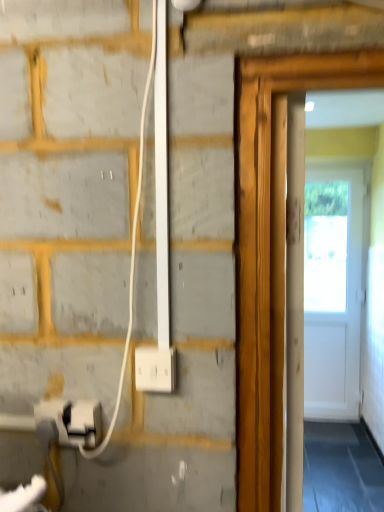
Question: Is point (66, 423) closer or farther from the camera than point (155, 356)?

Choices:
 (A) closer
 (B) farther

Answer: (B)

Question: Would you say white plastic electric outlet at lower left is to the left or to the right of white plastic socket at lower center in the picture?

Choices:
 (A) left
 (B) right

Answer: (A)

Question: Considering the positions of white plastic electric outlet at lower left and white plastic socket at lower center in the image, is white plastic electric outlet at lower left wider or thinner than white plastic socket at lower center?

Choices:
 (A) thin
 (B) wide

Answer: (A)

Question: Looking at their shapes, would you say white plastic socket at lower center is wider or thinner than white plastic electric outlet at lower left?

Choices:
 (A) wide
 (B) thin

Answer: (A)

Question: From their relative heights in the image, would you say white plastic socket at lower center is taller or shorter than white plastic electric outlet at lower left?

Choices:
 (A) short
 (B) tall

Answer: (B)

Question: Is white plastic socket at lower center inside the boundaries of white plastic electric outlet at lower left, or outside?

Choices:
 (A) inside
 (B) outside

Answer: (B)

Question: From the image's perspective, relative to white plastic electric outlet at lower left, is white plastic socket at lower center above or below?

Choices:
 (A) below
 (B) above

Answer: (B)